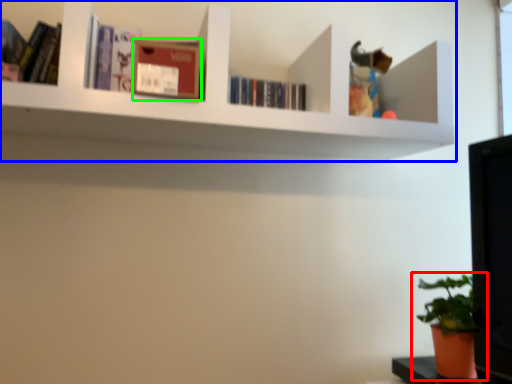
Question: Based on their relative distances, which object is farther from houseplant (highlighted by a red box)? Choose from shelf (highlighted by a blue box) and paperback book (highlighted by a green box).

Choices:
 (A) shelf
 (B) paperback book

Answer: (B)